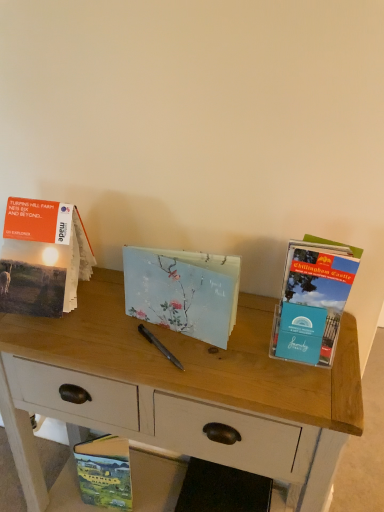
You are a GUI agent. You are given a task and a screenshot of the screen. Output one action in this format:
    pyautogui.click(x=<x>, y=<y>)
    Task: Click on the free space in front of matte paper book at left, the first book in the left-to-right sequence
    
    Given the screenshot: What is the action you would take?
    pyautogui.click(x=61, y=348)